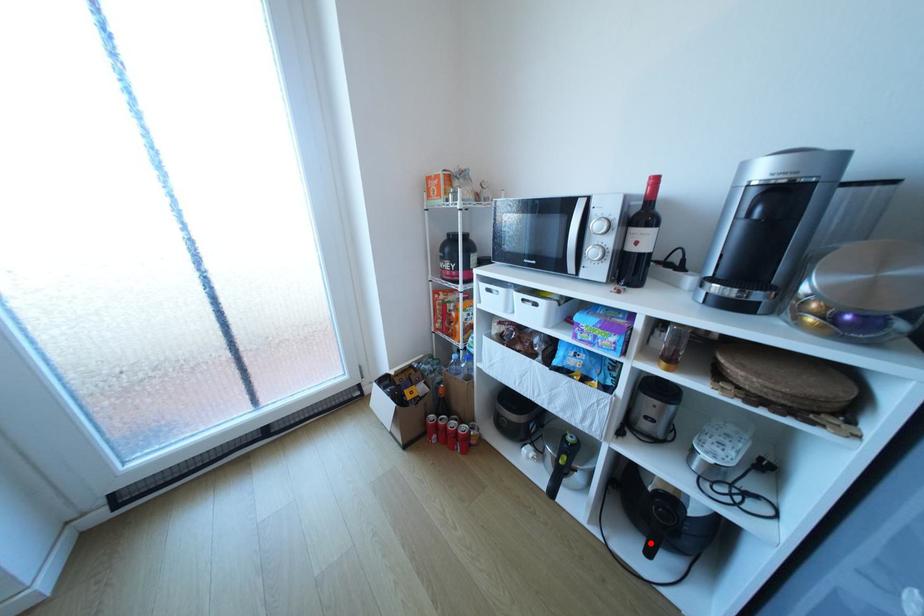
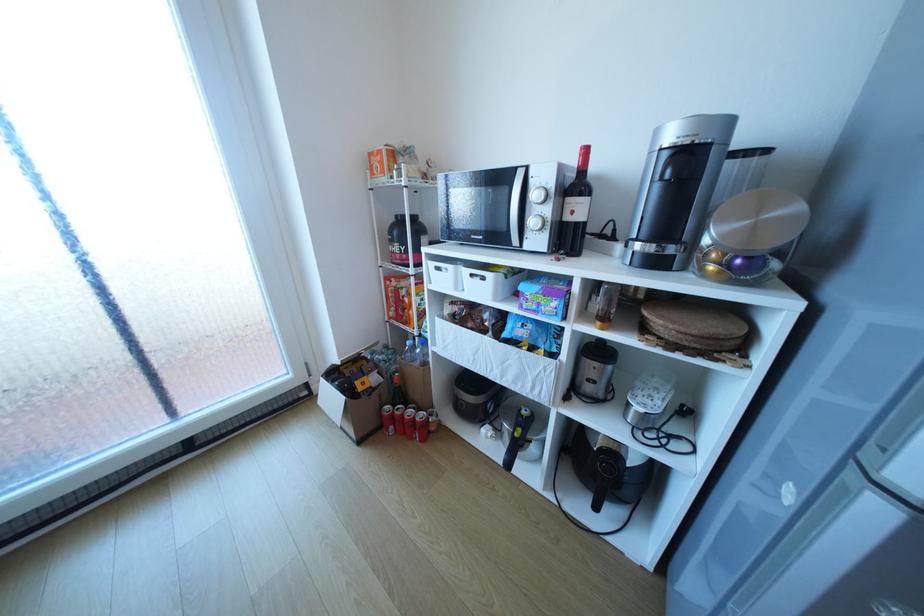
The point at the highlighted location is marked in the first image. Where is the corresponding point in the second image?

(599, 499)